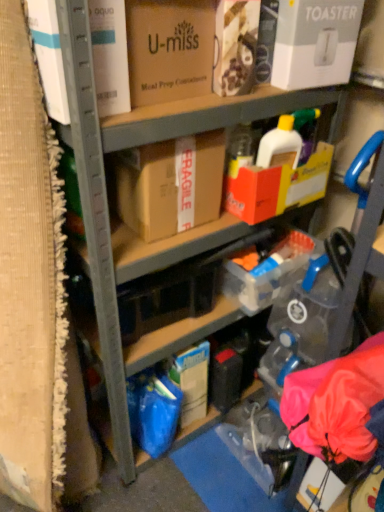
The image size is (384, 512). What do you see at coordinates (171, 184) in the screenshot? I see `brown cardboard box at center, which is counted as the 2th box, starting from the left` at bounding box center [171, 184].

The image size is (384, 512). Describe the element at coordinates (235, 46) in the screenshot. I see `matte cardboard box at upper center, placed as the third box when sorted from right to left` at that location.

Image resolution: width=384 pixels, height=512 pixels. What do you see at coordinates (315, 42) in the screenshot? I see `white cardboard toaster at upper right, positioned as the first box in right-to-left order` at bounding box center [315, 42].

Identify the location of white cardboard toaster at upper right, marked as the 5th box in a left-to-right arrangement. Image resolution: width=384 pixels, height=512 pixels. (315, 42).

In order to click on brown cardboard box at center, which is counted as the 2th box, starting from the left in this screenshot , I will do `click(171, 184)`.

Is brown cardboard box at center, the fourth box when ordered from right to left, located outside yellow cardboard box at center, the 2th box when ordered from right to left?

Yes, brown cardboard box at center, the fourth box when ordered from right to left, is outside of yellow cardboard box at center, the 2th box when ordered from right to left.

Between brown cardboard box at center, the fourth box when ordered from right to left, and yellow cardboard box at center, positioned as the fourth box in left-to-right order, which one has more height?

brown cardboard box at center, the fourth box when ordered from right to left, is taller.

Is brown cardboard box at center, the fourth box when ordered from right to left, wider or thinner than yellow cardboard box at center, the 2th box when ordered from right to left?

Clearly, brown cardboard box at center, the fourth box when ordered from right to left, has more width compared to yellow cardboard box at center, the 2th box when ordered from right to left.

Is point (220, 180) positioned behind point (314, 193)?

No, (220, 180) is closer to viewer.

Which of these two, yellow cardboard box at center, positioned as the fourth box in left-to-right order, or white cardboard toaster at upper right, marked as the 5th box in a left-to-right arrangement, is thinner?

white cardboard toaster at upper right, marked as the 5th box in a left-to-right arrangement, is thinner.

Is yellow cardboard box at center, the 2th box when ordered from right to left, to the right of white cardboard toaster at upper right, marked as the 5th box in a left-to-right arrangement, from the viewer's perspective?

No, yellow cardboard box at center, the 2th box when ordered from right to left, is not to the right of white cardboard toaster at upper right, marked as the 5th box in a left-to-right arrangement.

Is yellow cardboard box at center, the 2th box when ordered from right to left, far away from white cardboard toaster at upper right, positioned as the first box in right-to-left order?

Actually, yellow cardboard box at center, the 2th box when ordered from right to left, and white cardboard toaster at upper right, positioned as the first box in right-to-left order, are a little close together.

At what (x,y) coordinates should I click in order to perform the action: click on the 2nd box behind the white cardboard toaster at upper right, positioned as the first box in right-to-left order, counting from the anchor's position. Please return your answer as a coordinate pair (x, y). This screenshot has width=384, height=512. Looking at the image, I should click on (277, 187).

From the image's perspective, is brown cardboard box at center, which is counted as the 2th box, starting from the left, on matte cardboard box at upper center, positioned as the 3th box in left-to-right order?

No.

Is brown cardboard box at center, the fourth box when ordered from right to left, beside matte cardboard box at upper center, positioned as the 3th box in left-to-right order?

There is a gap between brown cardboard box at center, the fourth box when ordered from right to left, and matte cardboard box at upper center, positioned as the 3th box in left-to-right order.

Locate an element on the screen. The width and height of the screenshot is (384, 512). the 1st box to the left when counting from the matte cardboard box at upper center, positioned as the 3th box in left-to-right order is located at coordinates (171, 184).

Can you confirm if brown cardboard box at center, which is counted as the 2th box, starting from the left, is wider than matte cardboard box at upper center, placed as the third box when sorted from right to left?

Correct, the width of brown cardboard box at center, which is counted as the 2th box, starting from the left, exceeds that of matte cardboard box at upper center, placed as the third box when sorted from right to left.

Looking at this image, could white cardboard toaster at upper right, positioned as the first box in right-to-left order, be considered to be inside brown cardboard box at center, which is counted as the 2th box, starting from the left?

No, white cardboard toaster at upper right, positioned as the first box in right-to-left order, is not a part of brown cardboard box at center, which is counted as the 2th box, starting from the left.

Considering the positions of point (118, 162) and point (312, 10), is point (118, 162) closer or farther from the camera than point (312, 10)?

Point (118, 162).

Based on the photo, which is behind, brown cardboard box at center, which is counted as the 2th box, starting from the left, or white cardboard toaster at upper right, marked as the 5th box in a left-to-right arrangement?

brown cardboard box at center, which is counted as the 2th box, starting from the left, is behind.

From the image's perspective, is brown cardboard box at center, the fourth box when ordered from right to left, located above or below white cardboard toaster at upper right, positioned as the first box in right-to-left order?

From the image's perspective, brown cardboard box at center, the fourth box when ordered from right to left, appears below white cardboard toaster at upper right, positioned as the first box in right-to-left order.

Can you confirm if matte cardboard box at upper center, marked as the fifth box in a right-to-left arrangement, is positioned to the right of brown cardboard box at center, which is counted as the 2th box, starting from the left?

No, matte cardboard box at upper center, marked as the fifth box in a right-to-left arrangement, is not to the right of brown cardboard box at center, which is counted as the 2th box, starting from the left.

Which box is the 1st one when counting from the right side of the matte cardboard box at upper center, acting as the 1th box starting from the left? Please provide its 2D coordinates.

[(171, 184)]

In the scene shown: Measure the distance between matte cardboard box at upper center, marked as the fifth box in a right-to-left arrangement, and brown cardboard box at center, the fourth box when ordered from right to left.

matte cardboard box at upper center, marked as the fifth box in a right-to-left arrangement, is 7.51 inches away from brown cardboard box at center, the fourth box when ordered from right to left.

From the image's perspective, is matte cardboard box at upper center, marked as the fifth box in a right-to-left arrangement, located above or below brown cardboard box at center, which is counted as the 2th box, starting from the left?

Based on their image positions, matte cardboard box at upper center, marked as the fifth box in a right-to-left arrangement, is located above brown cardboard box at center, which is counted as the 2th box, starting from the left.

From a real-world perspective, which is physically below, brown cardboard box at center, the fourth box when ordered from right to left, or matte cardboard box at upper center, marked as the fifth box in a right-to-left arrangement?

brown cardboard box at center, the fourth box when ordered from right to left, from a real-world perspective.

Is there a large distance between brown cardboard box at center, the fourth box when ordered from right to left, and matte cardboard box at upper center, marked as the fifth box in a right-to-left arrangement?

No.

Image resolution: width=384 pixels, height=512 pixels. What are the coordinates of `the 3rd box in front of the brown cardboard box at center, which is counted as the 2th box, starting from the left, starting your count from the anchor` in the screenshot? It's located at (169, 49).

Considering the relative positions of brown cardboard box at center, the fourth box when ordered from right to left, and matte cardboard box at upper center, acting as the 1th box starting from the left, in the image provided, is brown cardboard box at center, the fourth box when ordered from right to left, to the left of matte cardboard box at upper center, acting as the 1th box starting from the left, from the viewer's perspective?

Incorrect, brown cardboard box at center, the fourth box when ordered from right to left, is not on the left side of matte cardboard box at upper center, acting as the 1th box starting from the left.

From a real-world perspective, is white cardboard toaster at upper right, positioned as the first box in right-to-left order, positioned over matte cardboard box at upper center, marked as the fifth box in a right-to-left arrangement, based on gravity?

No.

Identify the location of the 1st box located above the white cardboard toaster at upper right, positioned as the first box in right-to-left order (from a real-world perspective). (169, 49).

Considering the relative positions of white cardboard toaster at upper right, marked as the 5th box in a left-to-right arrangement, and matte cardboard box at upper center, acting as the 1th box starting from the left, in the image provided, is white cardboard toaster at upper right, marked as the 5th box in a left-to-right arrangement, to the left of matte cardboard box at upper center, acting as the 1th box starting from the left, from the viewer's perspective?

No, white cardboard toaster at upper right, marked as the 5th box in a left-to-right arrangement, is not to the left of matte cardboard box at upper center, acting as the 1th box starting from the left.

How distant is white cardboard toaster at upper right, positioned as the first box in right-to-left order, from matte cardboard box at upper center, marked as the fifth box in a right-to-left arrangement?

10.24 inches.

At what (x,y) coordinates should I click in order to perform the action: click on the 1st box above when counting from the brown cardboard box at center, the fourth box when ordered from right to left (from the image's perspective). Please return your answer as a coordinate pair (x, y). This screenshot has width=384, height=512. Looking at the image, I should click on (277, 187).

Starting from the white cardboard toaster at upper right, marked as the 5th box in a left-to-right arrangement, which box is the 1st one to the left? Please provide its 2D coordinates.

[(277, 187)]

From the image, which object appears to be farther from brown cardboard box at center, which is counted as the 2th box, starting from the left, yellow cardboard box at center, positioned as the fourth box in left-to-right order, or matte cardboard box at upper center, positioned as the 3th box in left-to-right order?

Among the two, matte cardboard box at upper center, positioned as the 3th box in left-to-right order, is located further to brown cardboard box at center, which is counted as the 2th box, starting from the left.

Based on their spatial positions, is matte cardboard box at upper center, positioned as the 3th box in left-to-right order, or matte cardboard box at upper center, acting as the 1th box starting from the left, closer to white cardboard toaster at upper right, marked as the 5th box in a left-to-right arrangement?

matte cardboard box at upper center, positioned as the 3th box in left-to-right order, lies closer to white cardboard toaster at upper right, marked as the 5th box in a left-to-right arrangement, than the other object.

Considering their positions, is white cardboard toaster at upper right, positioned as the first box in right-to-left order, positioned closer to brown cardboard box at center, which is counted as the 2th box, starting from the left, than matte cardboard box at upper center, positioned as the 3th box in left-to-right order?

Based on the image, matte cardboard box at upper center, positioned as the 3th box in left-to-right order, appears to be nearer to brown cardboard box at center, which is counted as the 2th box, starting from the left.

When comparing their distances from matte cardboard box at upper center, marked as the fifth box in a right-to-left arrangement, does yellow cardboard box at center, positioned as the fourth box in left-to-right order, or white cardboard toaster at upper right, positioned as the first box in right-to-left order, seem further?

Among the two, yellow cardboard box at center, positioned as the fourth box in left-to-right order, is located further to matte cardboard box at upper center, marked as the fifth box in a right-to-left arrangement.

Estimate the real-world distances between objects in this image. Which object is closer to matte cardboard box at upper center, acting as the 1th box starting from the left, white cardboard toaster at upper right, marked as the 5th box in a left-to-right arrangement, or matte cardboard box at upper center, positioned as the 3th box in left-to-right order?

matte cardboard box at upper center, positioned as the 3th box in left-to-right order, lies closer to matte cardboard box at upper center, acting as the 1th box starting from the left, than the other object.

Which object lies further to the anchor point matte cardboard box at upper center, acting as the 1th box starting from the left, white cardboard toaster at upper right, positioned as the first box in right-to-left order, or brown cardboard box at center, the fourth box when ordered from right to left?

Based on the image, white cardboard toaster at upper right, positioned as the first box in right-to-left order, appears to be further to matte cardboard box at upper center, acting as the 1th box starting from the left.

Looking at the image, which one is located closer to brown cardboard box at center, the fourth box when ordered from right to left, yellow cardboard box at center, the 2th box when ordered from right to left, or white cardboard toaster at upper right, positioned as the first box in right-to-left order?

yellow cardboard box at center, the 2th box when ordered from right to left.

Which object lies further to the anchor point yellow cardboard box at center, positioned as the fourth box in left-to-right order, matte cardboard box at upper center, positioned as the 3th box in left-to-right order, or matte cardboard box at upper center, acting as the 1th box starting from the left?

matte cardboard box at upper center, acting as the 1th box starting from the left, lies further to yellow cardboard box at center, positioned as the fourth box in left-to-right order, than the other object.